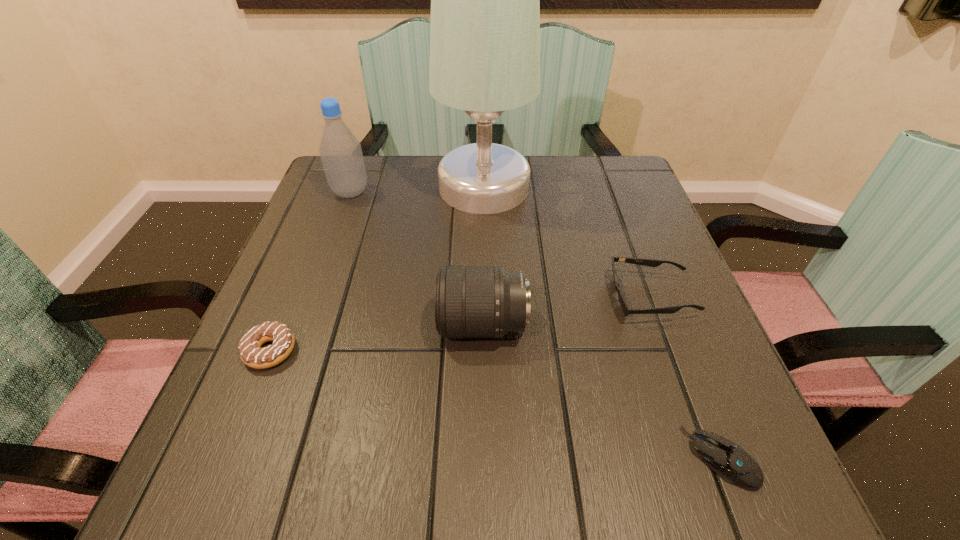
Find the location of `bottle that is at the far edge`. bottle that is at the far edge is located at coordinates (340, 151).

Where is `object located in the near edge section of the desktop`? The height and width of the screenshot is (540, 960). object located in the near edge section of the desktop is located at coordinates (727, 459).

The height and width of the screenshot is (540, 960). I want to click on bottle situated at the left edge, so click(340, 151).

Where is `doughnut that is at the left edge`? doughnut that is at the left edge is located at coordinates (251, 353).

Find the location of a particular element. Image resolution: width=960 pixels, height=540 pixels. sunglasses at the right edge is located at coordinates (626, 309).

Identify the location of computer mouse located at the right edge. (727, 459).

What are the coordinates of `object that is at the far left corner` in the screenshot? It's located at (340, 151).

Find the location of `object at the near right corner`. object at the near right corner is located at coordinates (727, 459).

The image size is (960, 540). I want to click on free location at the near edge, so click(x=488, y=458).

Locate an element on the screen. The height and width of the screenshot is (540, 960). free space at the left edge of the desktop is located at coordinates (341, 224).